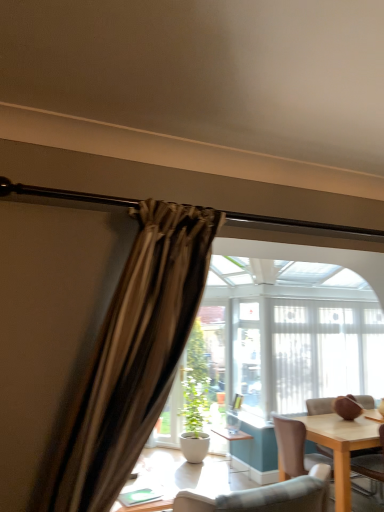
Question: From the image's perspective, relative to wooden chair at right, is white matte pot at center above or below?

Choices:
 (A) below
 (B) above

Answer: (A)

Question: From a real-world perspective, relative to wooden chair at right, is white matte pot at center vertically above or below?

Choices:
 (A) above
 (B) below

Answer: (A)

Question: Which object is the closest to the wooden chair at right?

Choices:
 (A) white matte pot at center
 (B) white sheer curtain at center

Answer: (B)

Question: Based on their relative distances, which object is farther from the white matte pot at center?

Choices:
 (A) white sheer curtain at center
 (B) wooden chair at right

Answer: (B)